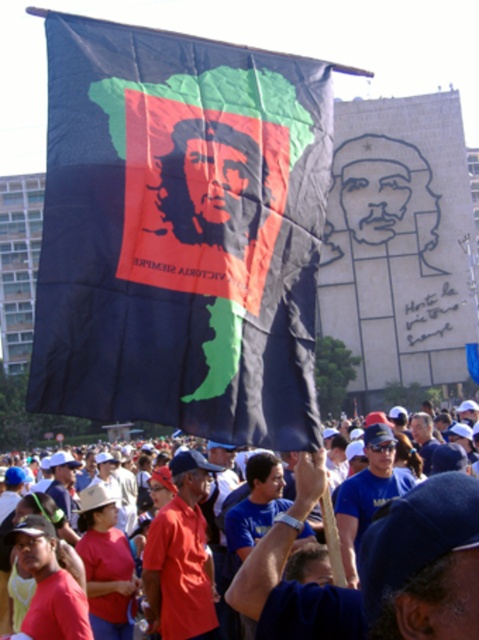
Between black fabric flag at center and matte black flag at upper center, which one appears on the left side from the viewer's perspective?

Positioned to the left is black fabric flag at center.

Is black fabric flag at center thinner than matte black flag at upper center?

In fact, black fabric flag at center might be wider than matte black flag at upper center.

Who is more distant from viewer, (x=286, y=168) or (x=301, y=605)?

The point (x=286, y=168) is behind.

Image resolution: width=479 pixels, height=640 pixels. In order to click on black fabric flag at center in this screenshot , I will do `click(181, 232)`.

Which of these two, black fabric flag at center or matte black flag at center, stands taller?

Standing taller between the two is black fabric flag at center.

Does black fabric flag at center have a lesser height compared to matte black flag at center?

Incorrect, black fabric flag at center's height does not fall short of matte black flag at center's.

Between point (168, 307) and point (389, 554), which one is positioned in front?

Point (389, 554) is in front.

Find the location of a particular element. This screenshot has width=479, height=640. black fabric flag at center is located at coordinates (181, 232).

Can you confirm if black fabric flag at center is smaller than red shirt at center?

No.

This screenshot has width=479, height=640. What are the coordinates of `black fabric flag at center` in the screenshot? It's located at (181, 232).

Where is `black fabric flag at center`? black fabric flag at center is located at coordinates (181, 232).